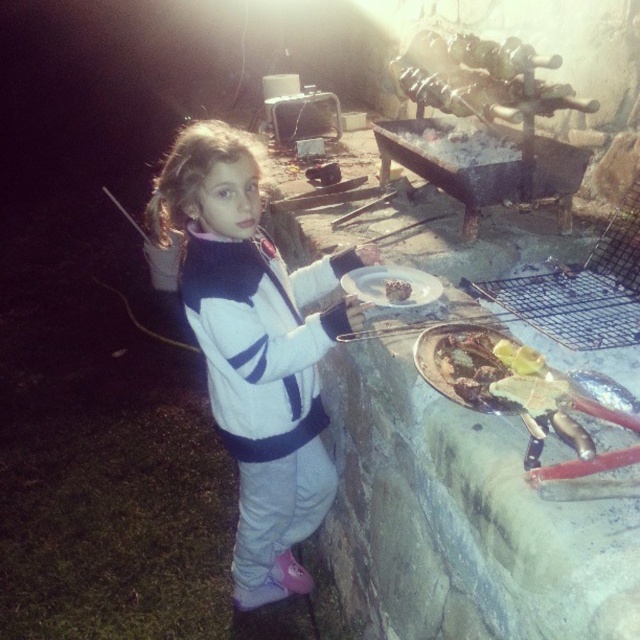
Question: Which point is farther from the camera taking this photo?

Choices:
 (A) (397, 291)
 (B) (376, 284)

Answer: (B)

Question: Which of these objects is positioned farthest from the white matte plate at upper center?

Choices:
 (A) white fleece jacket at center
 (B) white matte plate at center

Answer: (A)

Question: Which point appears farthest from the camera in this image?

Choices:
 (A) (403, 278)
 (B) (387, 282)

Answer: (A)

Question: Does white fleece jacket at center have a greater width compared to white matte plate at upper center?

Choices:
 (A) no
 (B) yes

Answer: (B)

Question: Is white fleece jacket at center above white matte plate at center?

Choices:
 (A) no
 (B) yes

Answer: (A)

Question: Is white matte plate at center bigger than white matte plate at upper center?

Choices:
 (A) yes
 (B) no

Answer: (A)